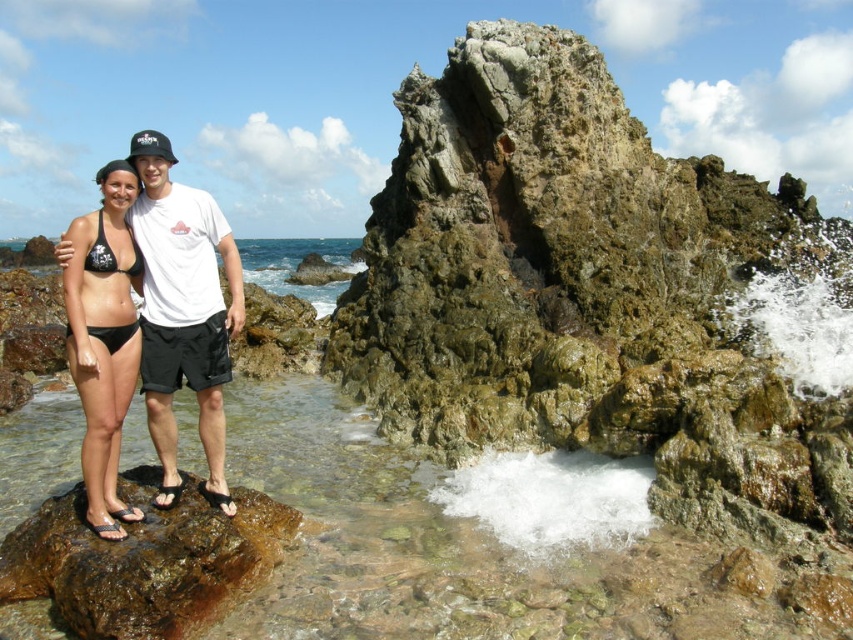
Question: Can you confirm if green mossy rock at center is wider than matte black bikini at left?

Choices:
 (A) no
 (B) yes

Answer: (B)

Question: Which of the following is the closest to the observer?

Choices:
 (A) (152, 304)
 (B) (384, 246)
 (C) (131, 374)

Answer: (C)

Question: In this image, where is green mossy rock at center located relative to matte black bikini at left?

Choices:
 (A) right
 (B) left

Answer: (A)

Question: Is matte black bikini at left to the right of black matte bikini at center from the viewer's perspective?

Choices:
 (A) no
 (B) yes

Answer: (B)

Question: Among these objects, which one is nearest to the camera?

Choices:
 (A) matte black bikini at left
 (B) green mossy rock at center

Answer: (B)

Question: Estimate the real-world distances between objects in this image. Which object is farther from the black matte bikini at center?

Choices:
 (A) brown rough rock at lower left
 (B) green mossy rock at center

Answer: (B)